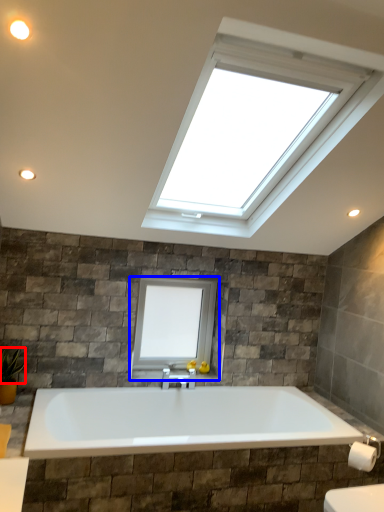
Question: Which object is closer to the camera taking this photo, plant (highlighted by a red box) or window (highlighted by a blue box)?

Choices:
 (A) plant
 (B) window

Answer: (A)